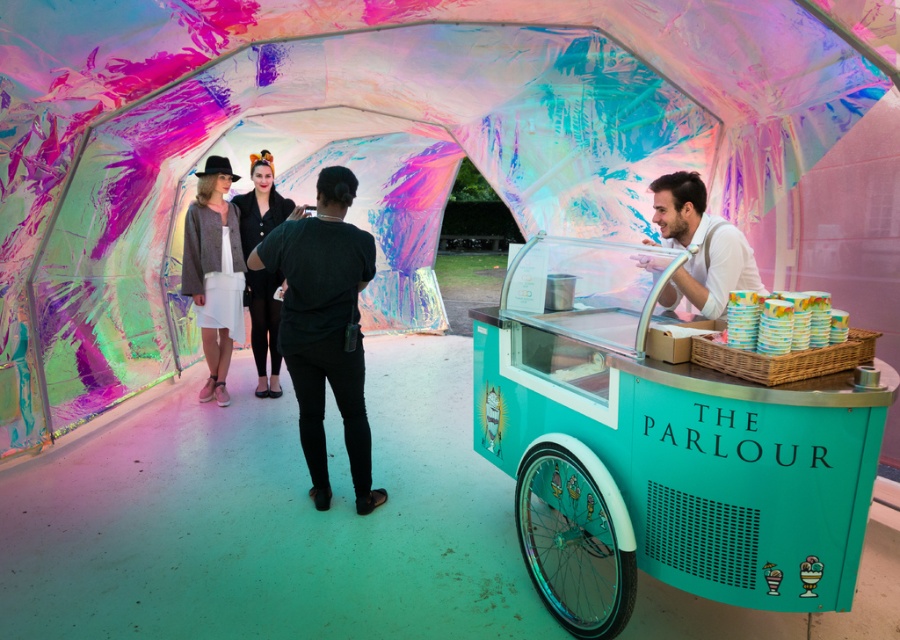
You are planning to place a decorative banner between the black leather jacket at center and the white glossy cups at right. The banner needs to be 12 feet long to cover the entire distance. Will the banner be long enough?

The black leather jacket at center and white glossy cups at right are 11.93 feet apart. The banner needs to be 12 feet long, so it will be slightly longer than the distance between them. Therefore, the banner will be long enough to cover the entire distance between the black leather jacket at center and the white glossy cups at right.

You are trying to determine the relative width of the objects in the image. Which object, the black matte shirt at center or the white glossy cups at right, could potentially be wider?

The black matte shirt at center might be wider than the white glossy cups at right according to the description.

You are a customer at the ice cream cart and want to place your items on the table. The table is just big enough to hold the black leather jacket at center. Can you also place the white glossy cups at right on the table without overcrowding it?

The black leather jacket at center has a larger size compared to white glossy cups at right. Since the table can only hold the jacket, there won